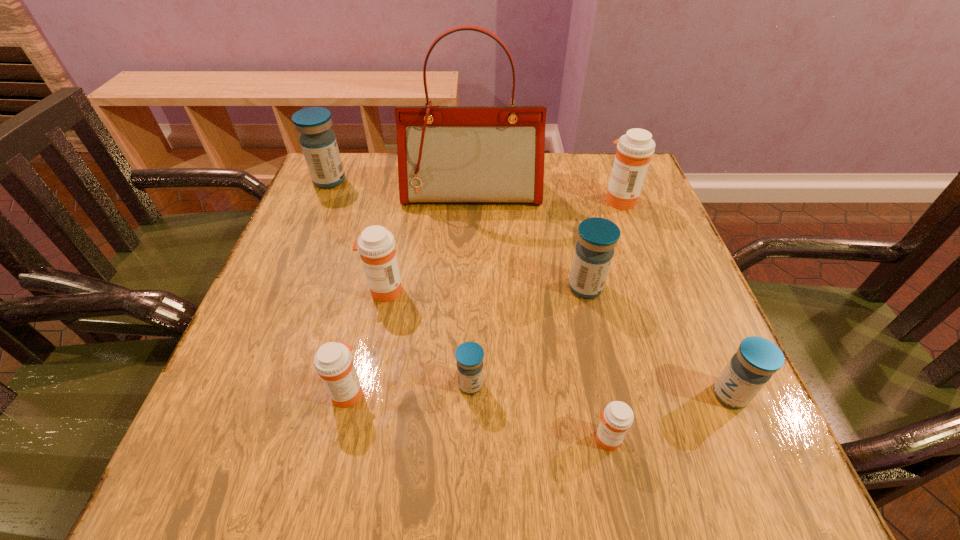
Point out which object is positioned as the nearest to the third blue medicine from left to right. Please provide its 2D coordinates. Your answer should be formatted as a tuple, i.e. [(x, y)], where the tuple contains the x and y coordinates of a point satisfying the conditions above.

[(751, 367)]

In order to click on medicine that is the closest to the third nearest orange medicine in this screenshot , I will do `click(333, 362)`.

Locate which medicine is the third closest to the third orange medicine from left to right. Please provide its 2D coordinates. Your answer should be formatted as a tuple, i.e. [(x, y)], where the tuple contains the x and y coordinates of a point satisfying the conditions above.

[(597, 237)]

Identify the location of blue medicine that is the third closest one to the handbag. (469, 355).

Choose which blue medicine is the nearest neighbor to the third biggest blue medicine. Please provide its 2D coordinates. Your answer should be formatted as a tuple, i.e. [(x, y)], where the tuple contains the x and y coordinates of a point satisfying the conditions above.

[(597, 237)]

Image resolution: width=960 pixels, height=540 pixels. I want to click on orange medicine object that ranks as the second closest to the second nearest orange medicine, so click(x=617, y=418).

I want to click on the second closest orange medicine to the second farthest orange medicine, so click(x=617, y=418).

You are a GUI agent. You are given a task and a screenshot of the screen. Output one action in this format:
    pyautogui.click(x=<x>, y=<y>)
    Task: Click on the vacant space that satisfies the following two spatial constraints: 1. on the front side of the pink handbag; 2. on the left side of the rightmost blue medicine
    Image resolution: width=960 pixels, height=540 pixels.
    Given the screenshot: What is the action you would take?
    pyautogui.click(x=468, y=395)